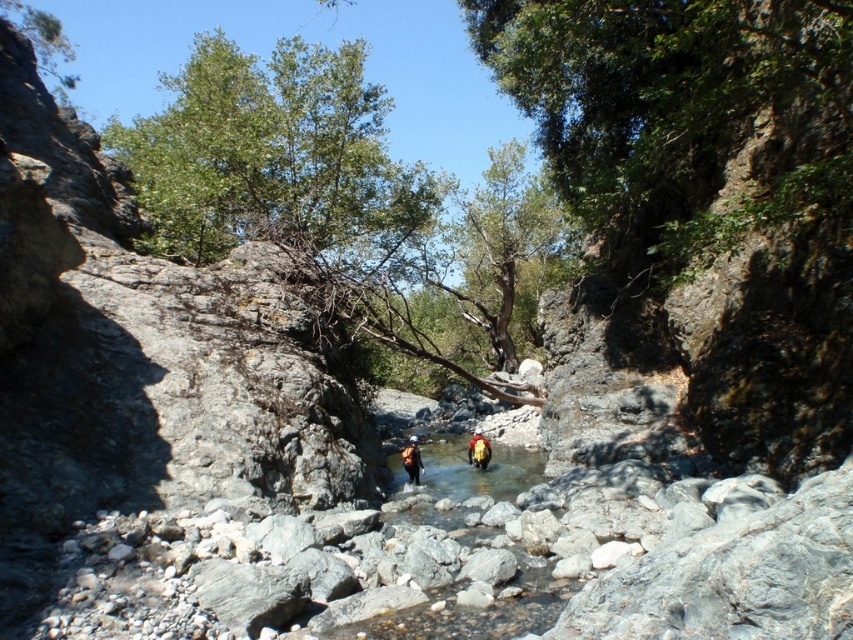
Between green leafy tree at upper center and yellow fabric backpack at center, which one has less height?

yellow fabric backpack at center is shorter.

Is green leafy tree at upper center to the right of yellow fabric backpack at center from the viewer's perspective?

In fact, green leafy tree at upper center is to the left of yellow fabric backpack at center.

Is point (192, 84) more distant than point (471, 458)?

Yes, it is.

Where is `green leafy tree at upper center`? Image resolution: width=853 pixels, height=640 pixels. green leafy tree at upper center is located at coordinates (274, 157).

Is green leafy tree at upper center to the right of yellow life jacket at center from the viewer's perspective?

In fact, green leafy tree at upper center is to the left of yellow life jacket at center.

Which is more to the right, green leafy tree at upper center or yellow life jacket at center?

Positioned to the right is yellow life jacket at center.

Does point (198, 166) lie behind point (412, 435)?

That is False.

Where is `green leafy tree at upper center`? green leafy tree at upper center is located at coordinates (274, 157).

Consider the image. Is yellow life jacket at center to the left of yellow fabric backpack at center from the viewer's perspective?

Correct, you'll find yellow life jacket at center to the left of yellow fabric backpack at center.

How distant is yellow life jacket at center from yellow fabric backpack at center?

A distance of 4.56 meters exists between yellow life jacket at center and yellow fabric backpack at center.

Which is behind, point (410, 470) or point (477, 445)?

The point (477, 445) is more distant.

In order to click on yellow life jacket at center in this screenshot , I will do `click(410, 460)`.